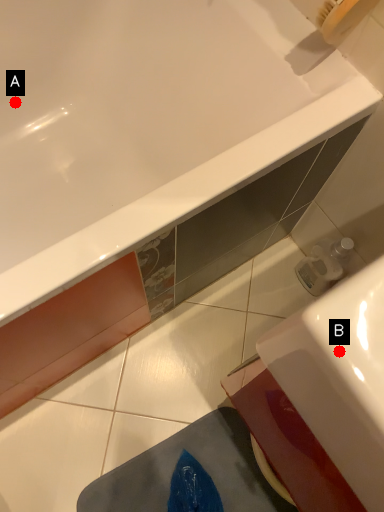
Question: Two points are circled on the image, labeled by A and B beside each circle. Which point is further to the camera?

Choices:
 (A) A is further
 (B) B is further

Answer: (A)